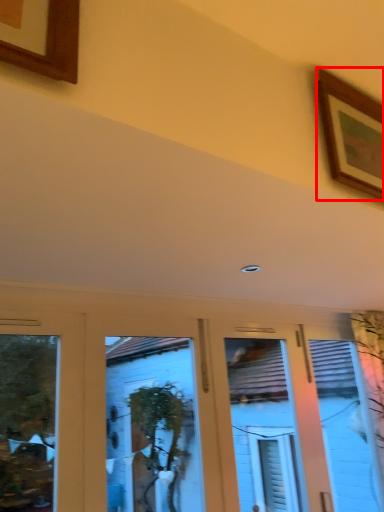
Question: From the image's perspective, what is the correct spatial positioning of picture frame (annotated by the red box) in reference to hotel lobby?

Choices:
 (A) above
 (B) below

Answer: (A)